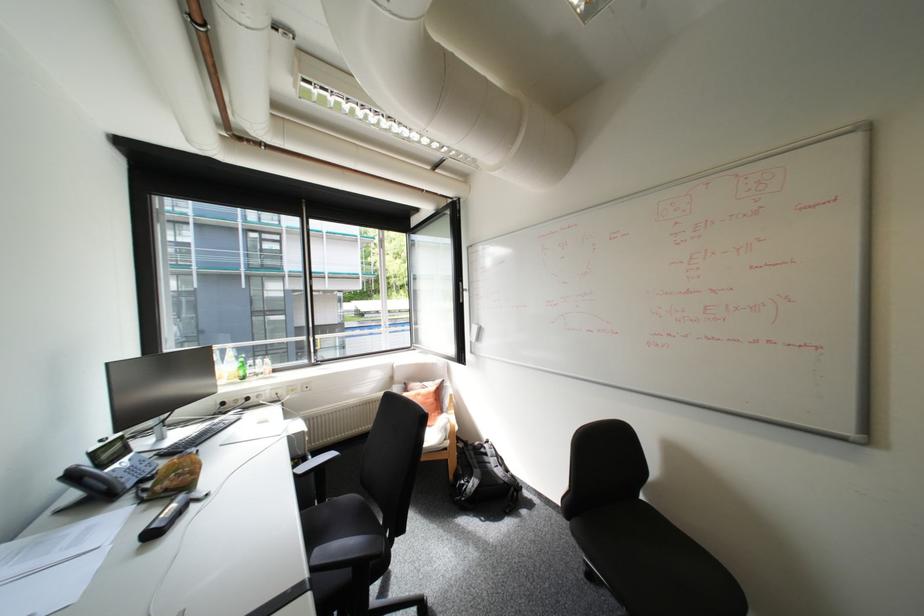
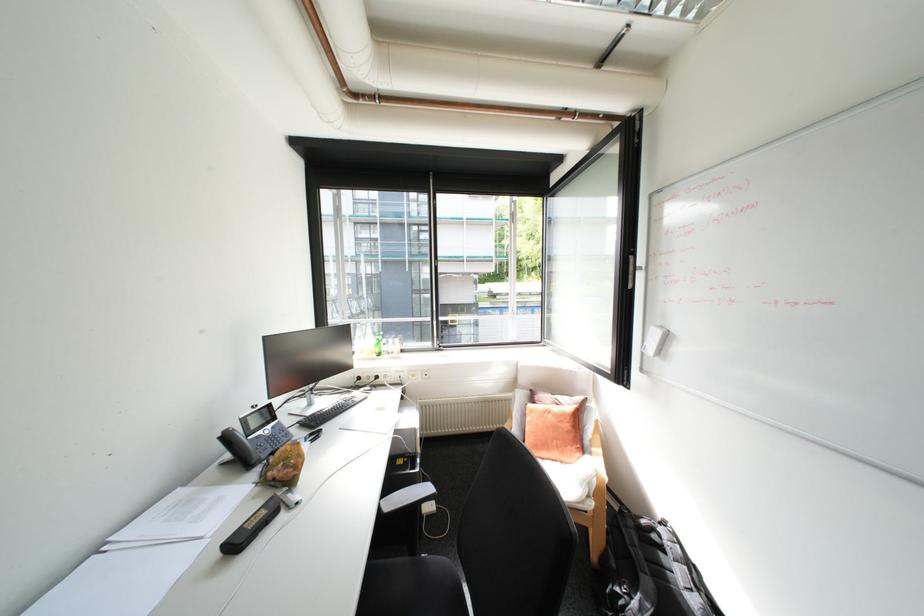
Find the pixel in the second image that matches [479,482] in the first image.

(640, 598)